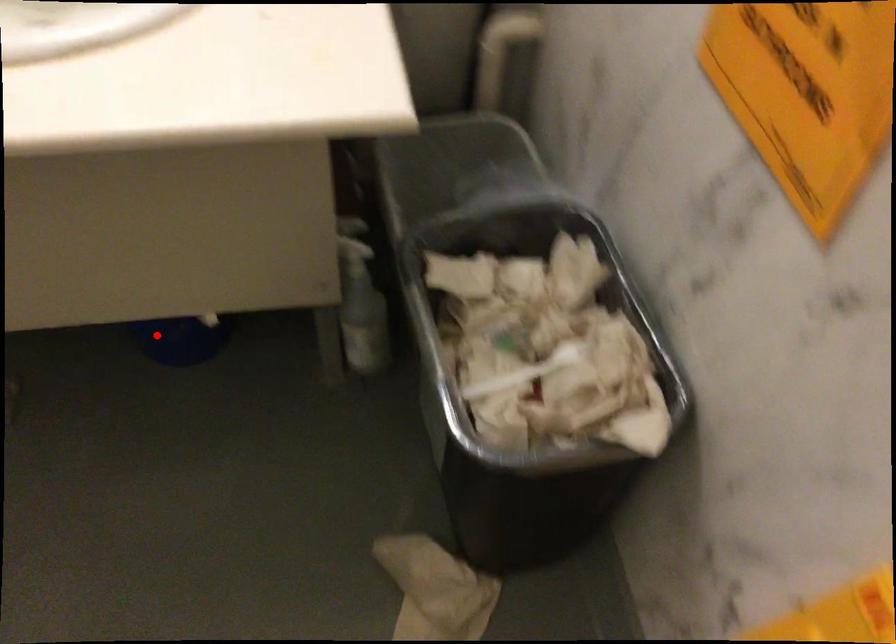
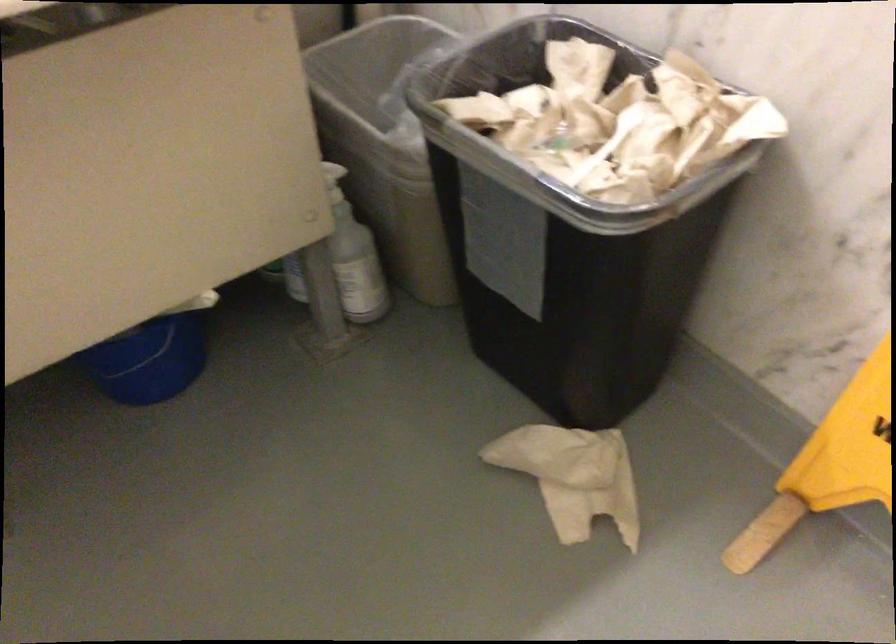
Find the pixel in the second image that matches the highlighted location in the first image.

(149, 361)